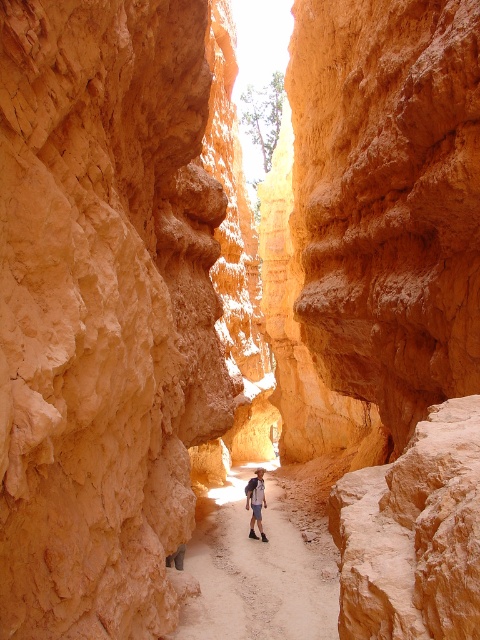
You are a hiker standing at the entrance of the canyon. You see the sandy dirt path at center. Can you walk straight ahead along the path without deviating left or right?

The sandy dirt path at center is located at point (259, 568), so yes, you can walk straight ahead along the path without deviating left or right.

You are a hiker planning to cross the sandy dirt path at center. Considering the height of the path compared to your denim shorts at center, do you think the path is tall enough to walk on comfortably?

The sandy dirt path at center is taller than denim shorts at center, so yes, the path is tall enough to walk on comfortably.